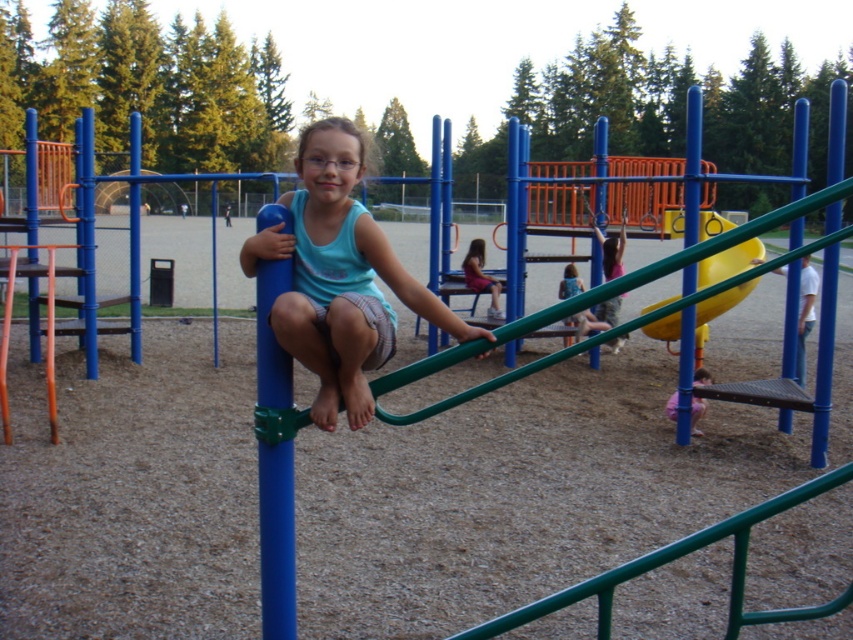
You are a parent trying to locate your child who is wearing a matte pink dress at center. You see the yellow rubber slide at center in the playground. Which object is closer to you?

The yellow rubber slide at center is closer to you because it is in front of the matte pink dress at center.

You are a photographer trying to capture both the matte pink shorts at center and the matte pink dress at center in a single frame. Which object should you focus on first to ensure both are in the frame?

The matte pink shorts at center is not as tall as the matte pink dress at center, so you should focus on the taller matte pink dress at center first to ensure both are in the frame.